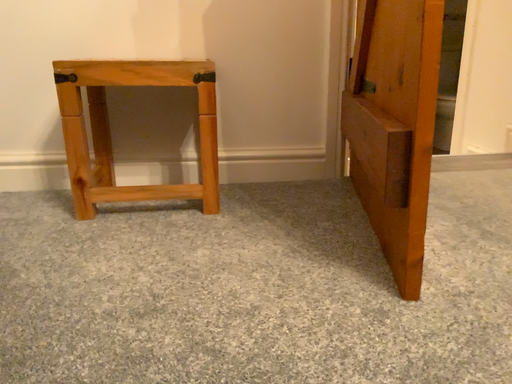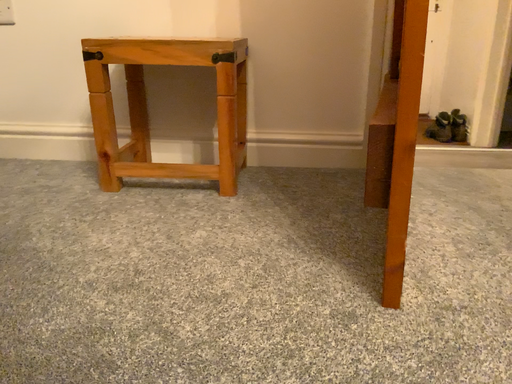
Question: How did the camera likely rotate when shooting the video?

Choices:
 (A) rotated right
 (B) rotated left

Answer: (B)